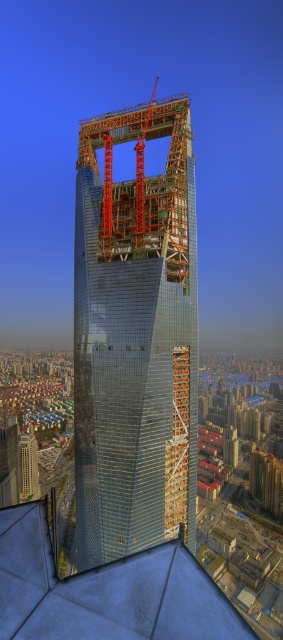
Question: Can you confirm if transparent glass tower at center is positioned to the left of orange metallic crane at upper center?

Choices:
 (A) no
 (B) yes

Answer: (B)

Question: Is transparent glass tower at center below orange metallic crane at upper center?

Choices:
 (A) no
 (B) yes

Answer: (B)

Question: Which of the following is the farthest from the observer?

Choices:
 (A) pyautogui.click(x=121, y=234)
 (B) pyautogui.click(x=155, y=348)

Answer: (A)

Question: Can you confirm if transparent glass tower at center is positioned to the right of orange metallic crane at upper center?

Choices:
 (A) no
 (B) yes

Answer: (A)

Question: Which of the following is the closest to the observer?

Choices:
 (A) transparent glass tower at center
 (B) orange metallic crane at upper center

Answer: (A)